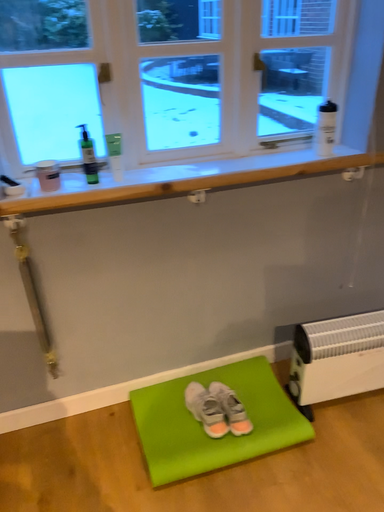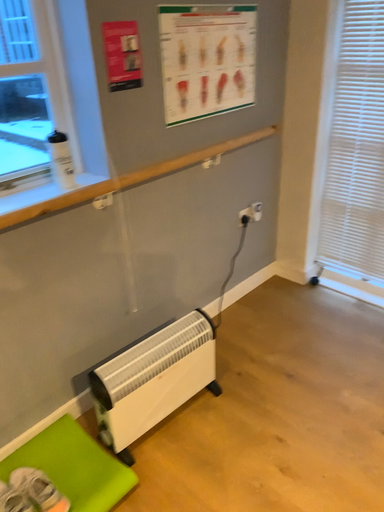
Question: Which way did the camera rotate in the video?

Choices:
 (A) rotated left
 (B) rotated right

Answer: (B)